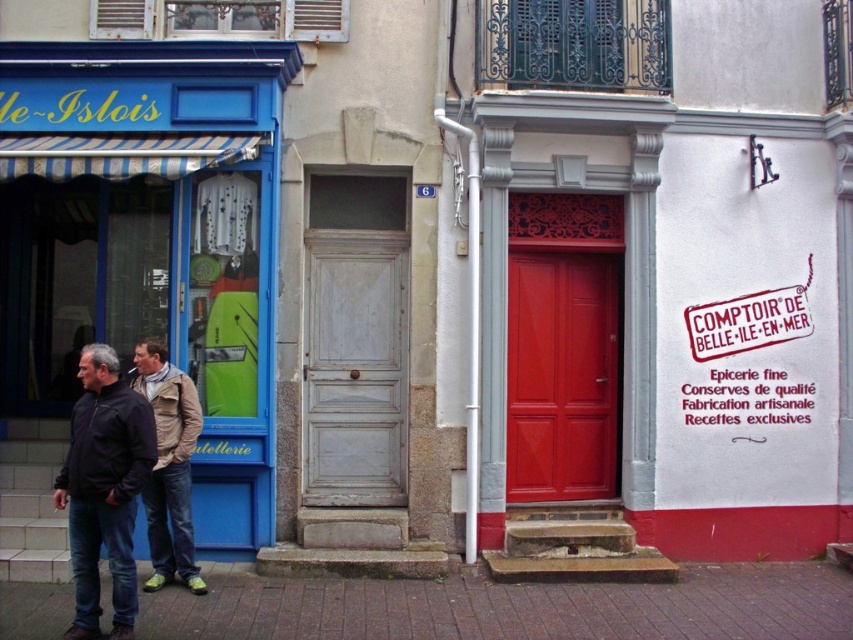
Which of these two, shiny red door at center or rubber stamp sign at center, stands taller?

Standing taller between the two is shiny red door at center.

Between shiny red door at center and rubber stamp sign at center, which one appears on the left side from the viewer's perspective?

From the viewer's perspective, shiny red door at center appears more on the left side.

Is point (596, 376) closer to camera compared to point (795, 291)?

No, it is not.

Locate an element on the screen. shiny red door at center is located at coordinates 561,376.

Can you confirm if white wooden door at center is positioned to the left of shiny red door at center?

Correct, you'll find white wooden door at center to the left of shiny red door at center.

Between point (370, 490) and point (527, 362), which one is positioned in front?

Point (370, 490) is in front.

What do you see at coordinates (355, 368) in the screenshot? This screenshot has height=640, width=853. I see `white wooden door at center` at bounding box center [355, 368].

You are a GUI agent. You are given a task and a screenshot of the screen. Output one action in this format:
    pyautogui.click(x=<x>, y=<y>)
    Task: Click on the white wooden door at center
    The height and width of the screenshot is (640, 853).
    Given the screenshot: What is the action you would take?
    pyautogui.click(x=355, y=368)

Is point (373, 472) more distant than point (152, 401)?

Yes, point (373, 472) is farther from viewer.

Does white wooden door at center have a lesser height compared to khaki fabric jacket at center?

In fact, white wooden door at center may be taller than khaki fabric jacket at center.

Locate an element on the screen. white wooden door at center is located at coordinates (355, 368).